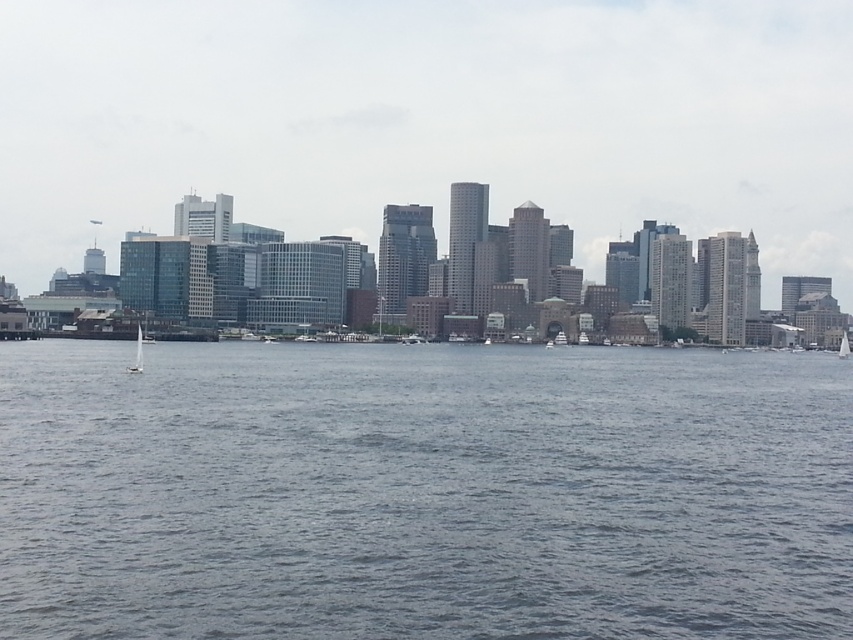
Question: Which object appears farthest from the camera in this image?

Choices:
 (A) transparent glass skyscrapers at center
 (B) gray water at center
 (C) white glossy sailboat at lower left

Answer: (A)

Question: Which point is farther to the camera?

Choices:
 (A) transparent glass skyscrapers at center
 (B) white sailboat at right
 (C) white glossy sailboat at lower left

Answer: (A)

Question: Can you confirm if white glossy sailboat at lower left is positioned to the right of white sailboat at right?

Choices:
 (A) no
 (B) yes

Answer: (A)

Question: Among these objects, which one is farthest from the camera?

Choices:
 (A) white glossy sailboat at lower left
 (B) white sailboat at right

Answer: (B)

Question: Is gray water at center smaller than white sailboat at right?

Choices:
 (A) no
 (B) yes

Answer: (A)

Question: Is white glossy sailboat at lower left to the right of white sailboat at right from the viewer's perspective?

Choices:
 (A) no
 (B) yes

Answer: (A)